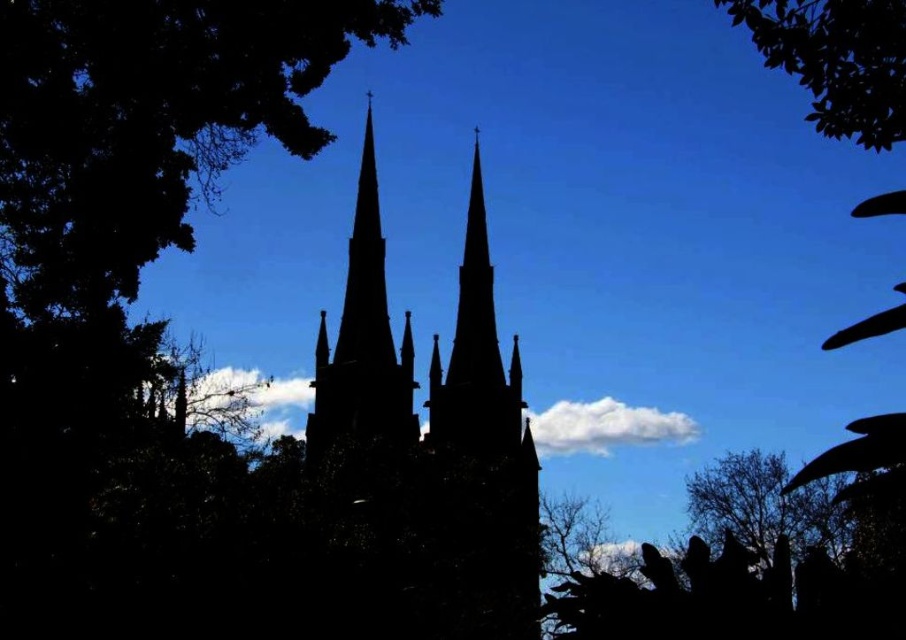
Question: Which of the following is the farthest from the observer?

Choices:
 (A) (350, 268)
 (B) (781, 474)
 (C) (355, 365)

Answer: (B)

Question: Does silhouette church at center appear on the right side of silhouette stone tower at center?

Choices:
 (A) no
 (B) yes

Answer: (B)

Question: Which object appears closest to the camera in this image?

Choices:
 (A) silhouette leafy tree at lower right
 (B) silhouette church at center
 (C) silhouette stone tower at center

Answer: (C)

Question: Does silhouette stone tower at center appear under silhouette leafy tree at lower right?

Choices:
 (A) yes
 (B) no

Answer: (B)

Question: Based on their relative distances, which object is farther from the silhouette stone tower at center?

Choices:
 (A) silhouette leafy tree at lower right
 (B) silhouette church at center

Answer: (A)

Question: Can you confirm if silhouette church at center is positioned to the left of silhouette stone tower at center?

Choices:
 (A) no
 (B) yes

Answer: (A)